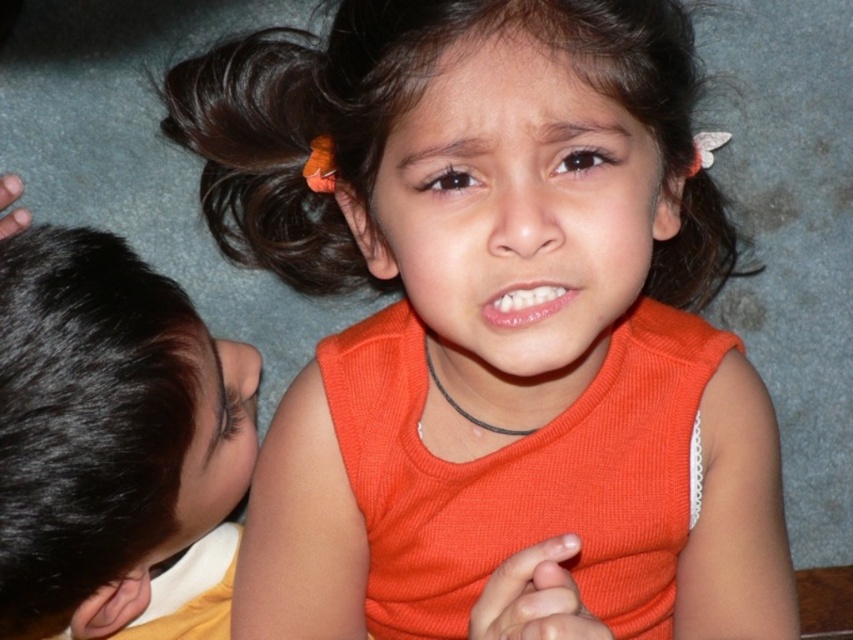
Who is lower down, black hair at left or brown matte hair at upper center?

Positioned lower is black hair at left.

Where is `black hair at left`? The width and height of the screenshot is (853, 640). black hair at left is located at coordinates (114, 445).